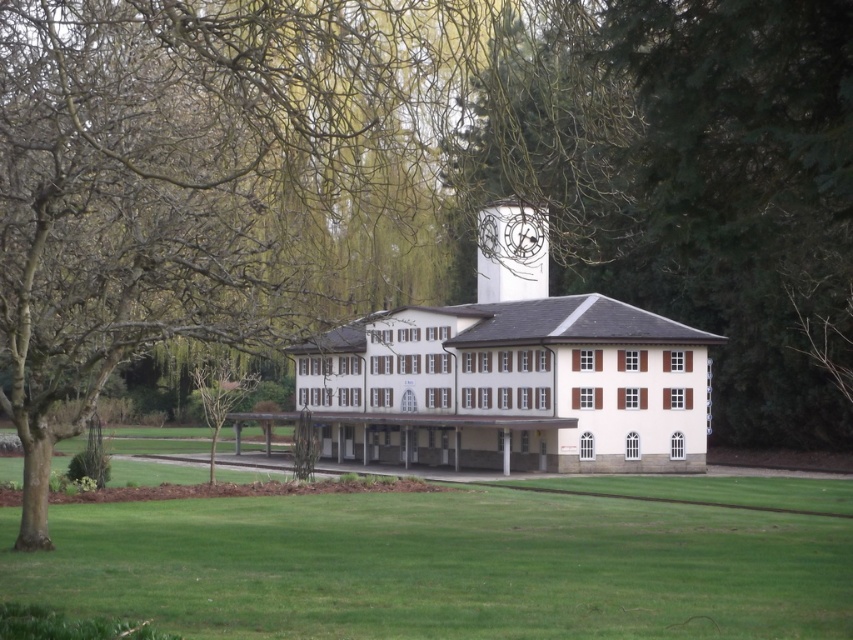
Does green grass at center have a lesser height compared to white painted clock at center?

Yes, green grass at center is shorter than white painted clock at center.

Is point (474, 486) positioned before point (511, 234)?

No, it is not.

Is point (733, 627) less distant than point (500, 237)?

Yes, point (733, 627) is in front of point (500, 237).

The height and width of the screenshot is (640, 853). In order to click on green grass at center in this screenshot , I will do `click(442, 566)`.